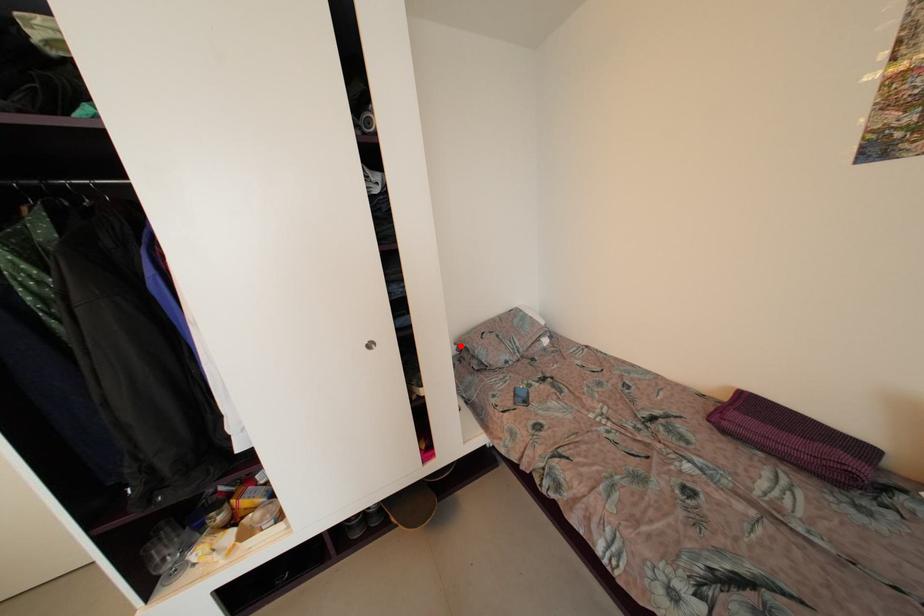
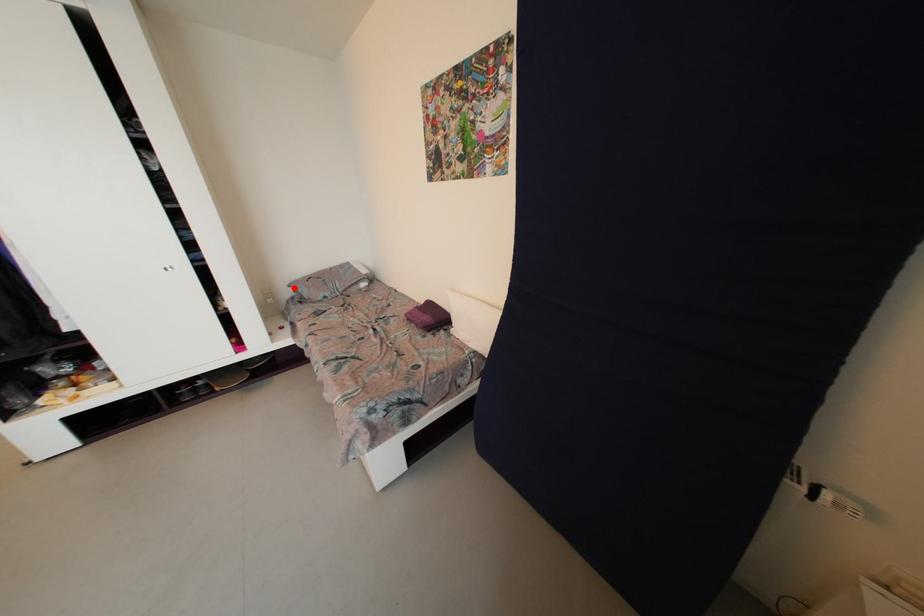
I am providing you with two images of the same scene from different viewpoints. A red point is marked on the first image and another point is marked on the second image. Do the highlighted points in image1 and image2 indicate the same real-world spot?

Yes